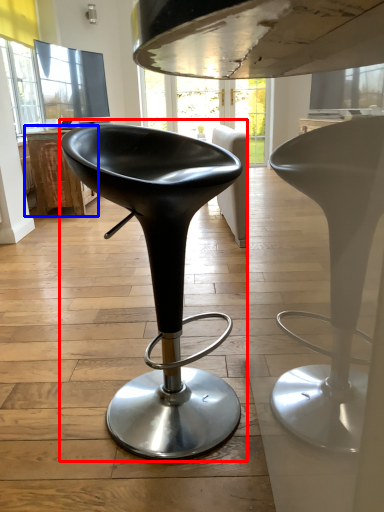
Question: Among these objects, which one is nearest to the camera, chair (highlighted by a red box) or table (highlighted by a blue box)?

Choices:
 (A) chair
 (B) table

Answer: (A)